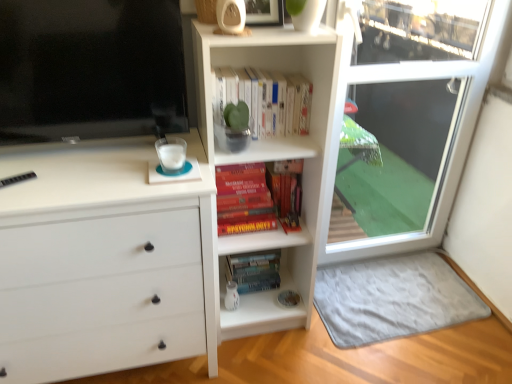
Question: Is hardcover books at center, the second book viewed from the top, positioned far away from flat screen tv at upper left?

Choices:
 (A) no
 (B) yes

Answer: (A)

Question: Could flat screen tv at upper left be considered to be inside hardcover books at center, acting as the first book starting from the bottom?

Choices:
 (A) no
 (B) yes

Answer: (A)

Question: Is hardcover books at center, the second book viewed from the top, facing towards flat screen tv at upper left?

Choices:
 (A) yes
 (B) no

Answer: (B)

Question: From a real-world perspective, is hardcover books at center, the second book viewed from the top, positioned over flat screen tv at upper left based on gravity?

Choices:
 (A) yes
 (B) no

Answer: (B)

Question: Considering the relative positions of hardcover books at center, the second book viewed from the top, and flat screen tv at upper left in the image provided, is hardcover books at center, the second book viewed from the top, to the left of flat screen tv at upper left from the viewer's perspective?

Choices:
 (A) no
 (B) yes

Answer: (A)

Question: Considering the positions of point (231, 77) and point (124, 3), is point (231, 77) closer or farther from the camera than point (124, 3)?

Choices:
 (A) farther
 (B) closer

Answer: (A)

Question: In terms of size, does white matte book at upper center, which ranks as the 1th book in top-to-bottom order, appear bigger or smaller than flat screen tv at upper left?

Choices:
 (A) small
 (B) big

Answer: (A)

Question: In terms of height, does white matte book at upper center, which ranks as the 1th book in top-to-bottom order, look taller or shorter compared to flat screen tv at upper left?

Choices:
 (A) tall
 (B) short

Answer: (B)

Question: From the image's perspective, is white matte book at upper center, which ranks as the 1th book in top-to-bottom order, positioned above or below flat screen tv at upper left?

Choices:
 (A) below
 (B) above

Answer: (A)

Question: In terms of size, does gray soft rug at lower right appear bigger or smaller than flat screen tv at upper left?

Choices:
 (A) big
 (B) small

Answer: (B)

Question: From the image's perspective, is gray soft rug at lower right located above or below flat screen tv at upper left?

Choices:
 (A) below
 (B) above

Answer: (A)

Question: Considering the positions of gray soft rug at lower right and flat screen tv at upper left in the image, is gray soft rug at lower right wider or thinner than flat screen tv at upper left?

Choices:
 (A) thin
 (B) wide

Answer: (B)

Question: From a real-world perspective, is gray soft rug at lower right positioned above or below flat screen tv at upper left?

Choices:
 (A) below
 (B) above

Answer: (A)

Question: Considering the positions of gray soft rug at lower right and hardcover books at center, acting as the first book starting from the bottom, in the image, is gray soft rug at lower right wider or thinner than hardcover books at center, acting as the first book starting from the bottom,?

Choices:
 (A) wide
 (B) thin

Answer: (A)

Question: From their relative heights in the image, would you say gray soft rug at lower right is taller or shorter than hardcover books at center, the second book viewed from the top?

Choices:
 (A) short
 (B) tall

Answer: (A)